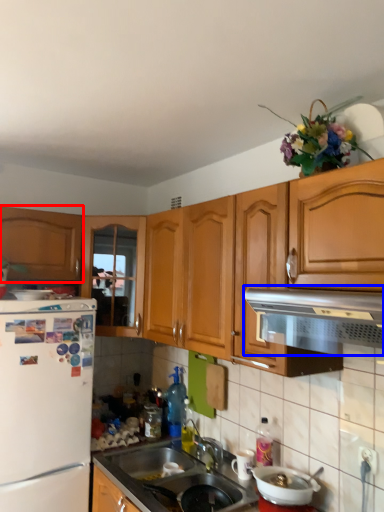
Question: Which point is closer to the camera, cabinetry (highlighted by a red box) or vent (highlighted by a blue box)?

Choices:
 (A) cabinetry
 (B) vent

Answer: (B)